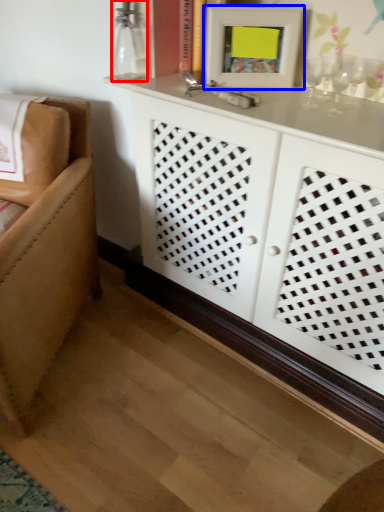
Question: Among these objects, which one is farthest to the camera, glass vase (highlighted by a red box) or picture frame (highlighted by a blue box)?

Choices:
 (A) glass vase
 (B) picture frame

Answer: (A)